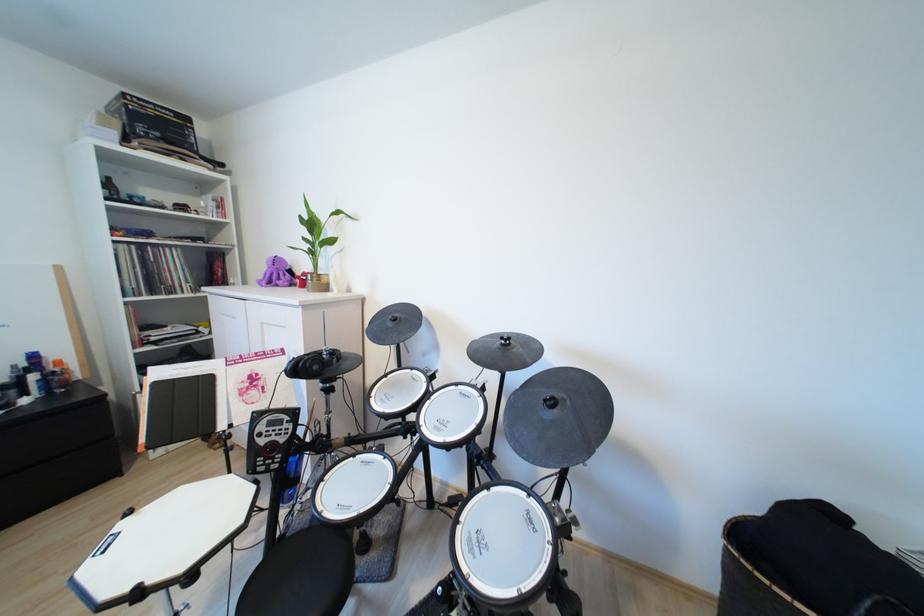
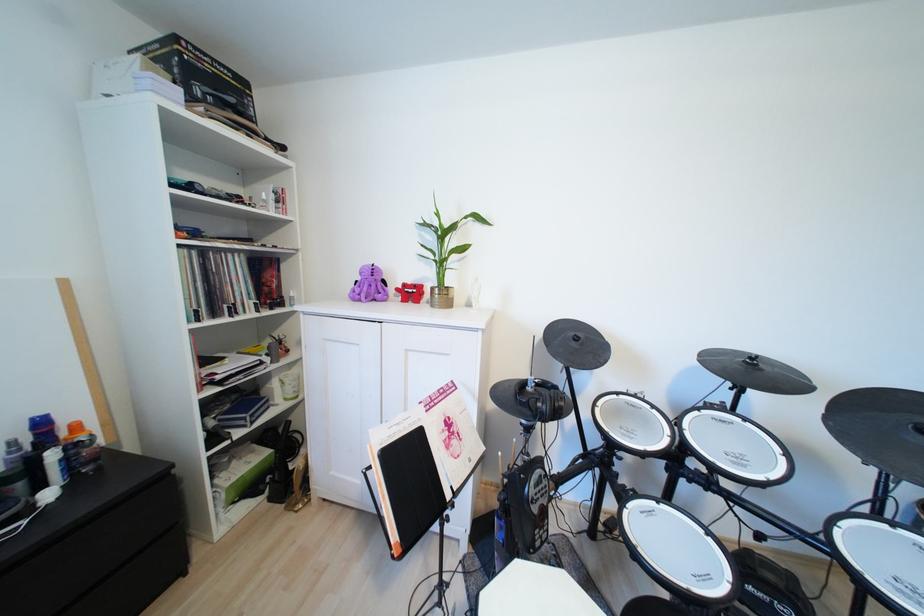
Question: What movement of the cameraman would produce the second image?

Choices:
 (A) Left
 (B) Right
 (C) Forward
 (D) Backward

Answer: (A)